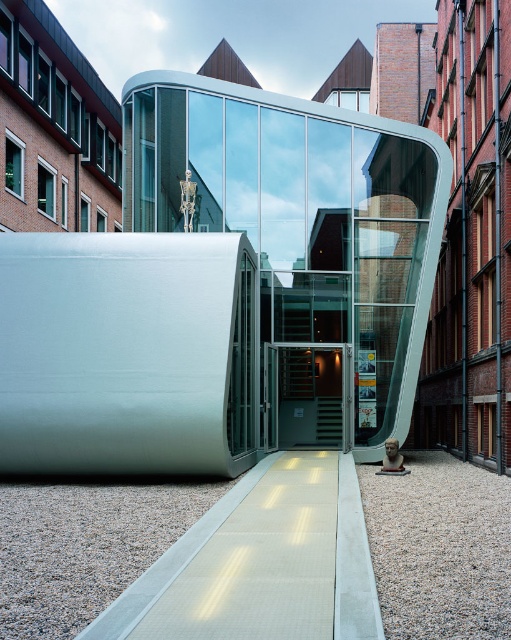
Looking at this image, is polished glass sculpture at center thinner than metallic glass door at center?

No.

Is polished glass sculpture at center to the left of metallic glass door at center from the viewer's perspective?

Indeed, polished glass sculpture at center is positioned on the left side of metallic glass door at center.

What do you see at coordinates (360, 211) in the screenshot? I see `polished glass sculpture at center` at bounding box center [360, 211].

Locate an element on the screen. polished glass sculpture at center is located at coordinates (360, 211).

Can you confirm if polished glass sculpture at center is bigger than white textured walkway at center?

Correct, polished glass sculpture at center is larger in size than white textured walkway at center.

Is polished glass sculpture at center below white textured walkway at center?

Actually, polished glass sculpture at center is above white textured walkway at center.

Is point (402, 388) in front of point (336, 477)?

No, it is not.

Locate an element on the screen. This screenshot has height=640, width=511. polished glass sculpture at center is located at coordinates pos(360,211).

The image size is (511, 640). What do you see at coordinates (261, 563) in the screenshot? I see `white textured walkway at center` at bounding box center [261, 563].

Is white textured walkway at center positioned behind metallic glass door at center?

No, it is in front of metallic glass door at center.

Which is behind, point (290, 636) or point (273, 413)?

The point (273, 413) is more distant.

The image size is (511, 640). I want to click on white textured walkway at center, so click(x=261, y=563).